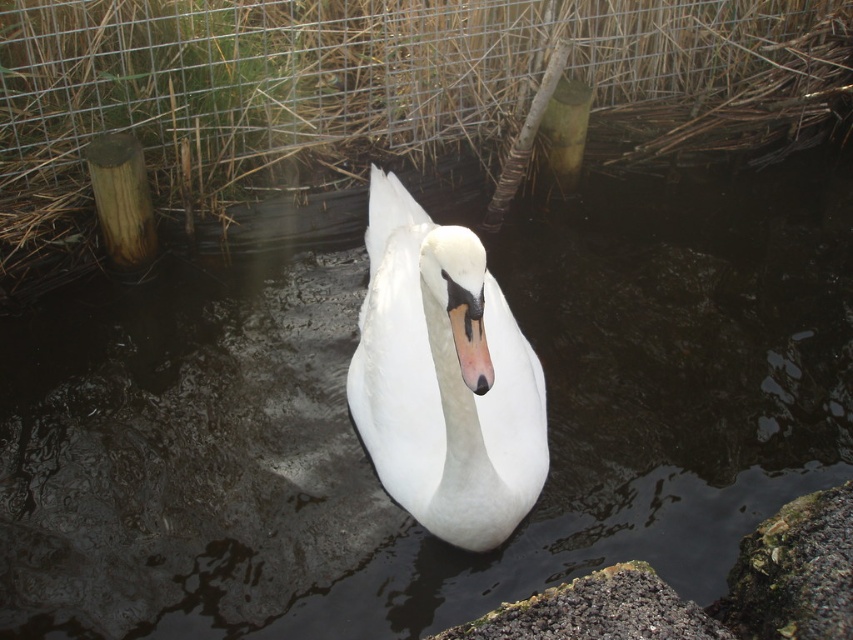
Question: From the image, what is the correct spatial relationship of metal wire fence at upper center in relation to gray gravelly rock at lower center?

Choices:
 (A) above
 (B) below

Answer: (A)

Question: Is metal wire fence at upper center thinner than gray gravelly rock at lower center?

Choices:
 (A) yes
 (B) no

Answer: (B)

Question: Considering the real-world distances, which object is farthest from the metal wire fence at upper center?

Choices:
 (A) gray gravelly rock at lower center
 (B) white glossy swan at center

Answer: (A)

Question: Is white glossy swan at center smaller than gray gravelly rock at lower center?

Choices:
 (A) yes
 (B) no

Answer: (B)

Question: Based on their relative distances, which object is nearer to the metal wire fence at upper center?

Choices:
 (A) gray gravelly rock at lower center
 (B) white glossy swan at center

Answer: (B)

Question: Estimate the real-world distances between objects in this image. Which object is closer to the metal wire fence at upper center?

Choices:
 (A) white glossy swan at center
 (B) gray gravelly rock at lower center

Answer: (A)